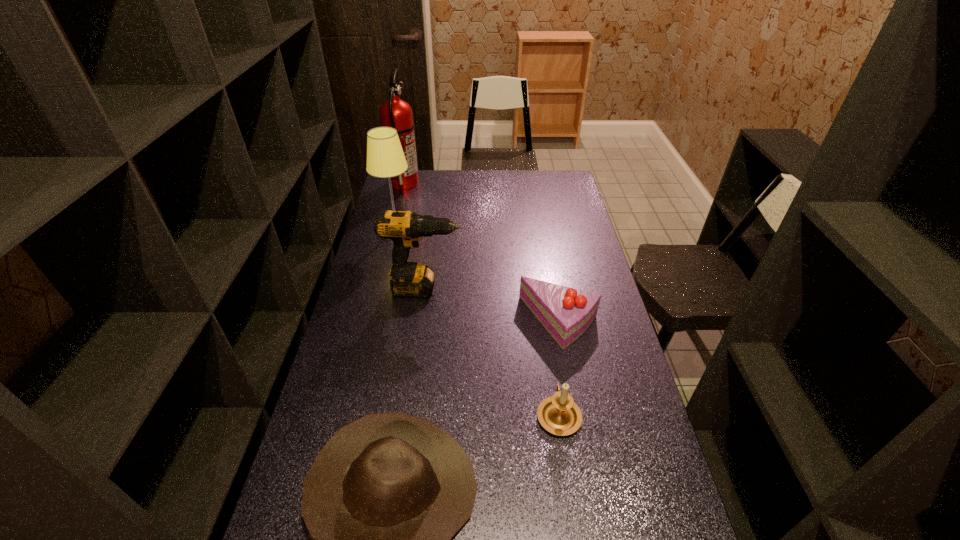
At what (x,y) coordinates should I click in order to perform the action: click on fire extinguisher. Please return your answer as a coordinate pair (x, y). The image size is (960, 540). Looking at the image, I should click on click(396, 113).

Where is `the tallest object`? This screenshot has height=540, width=960. the tallest object is located at coordinates (396, 113).

Find the location of a particular element. The width and height of the screenshot is (960, 540). the second farthest object is located at coordinates (385, 158).

Identify the location of the second tallest object. (385, 158).

Find the location of `the fourth shortest object`. the fourth shortest object is located at coordinates (409, 279).

At what (x,y) coordinates should I click in order to perform the action: click on candle holder. Please return your answer as a coordinate pair (x, y). The image size is (960, 540). Looking at the image, I should click on (559, 414).

Identify the location of cake. (566, 313).

The image size is (960, 540). Identify the location of free location located at the nozzle of the tallest object. (450, 183).

Find the location of `vacant area located 0.380m on the front of the table lamp`. vacant area located 0.380m on the front of the table lamp is located at coordinates (377, 306).

Where is `free space located at the tip of the third tallest object`? The height and width of the screenshot is (540, 960). free space located at the tip of the third tallest object is located at coordinates (518, 288).